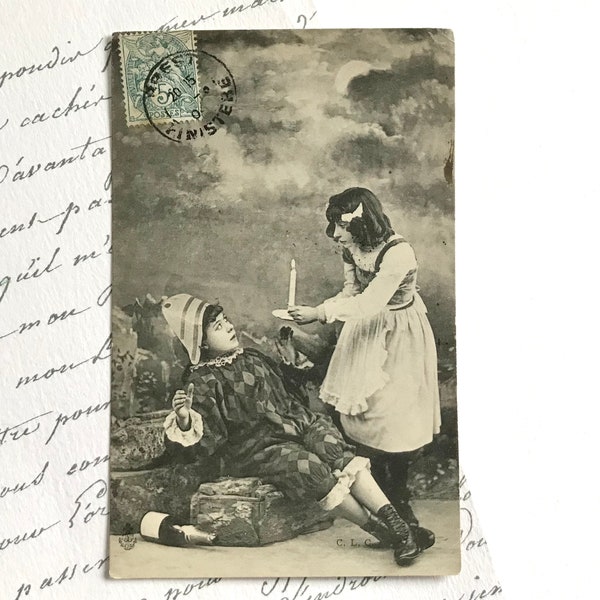
Locate an element on the screen. Image resolution: width=600 pixels, height=600 pixels. candlestick is located at coordinates (291, 295).